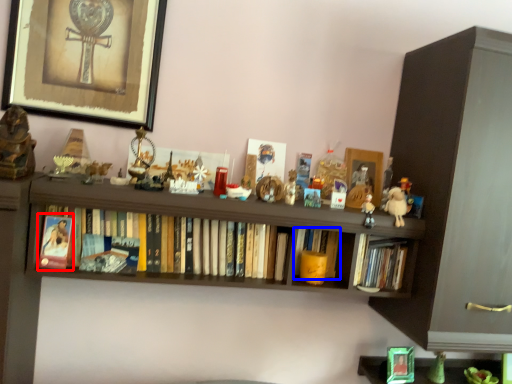
Question: Which object is closer to the camera taking this photo, paperback book (highlighted by a red box) or book (highlighted by a blue box)?

Choices:
 (A) paperback book
 (B) book

Answer: (A)